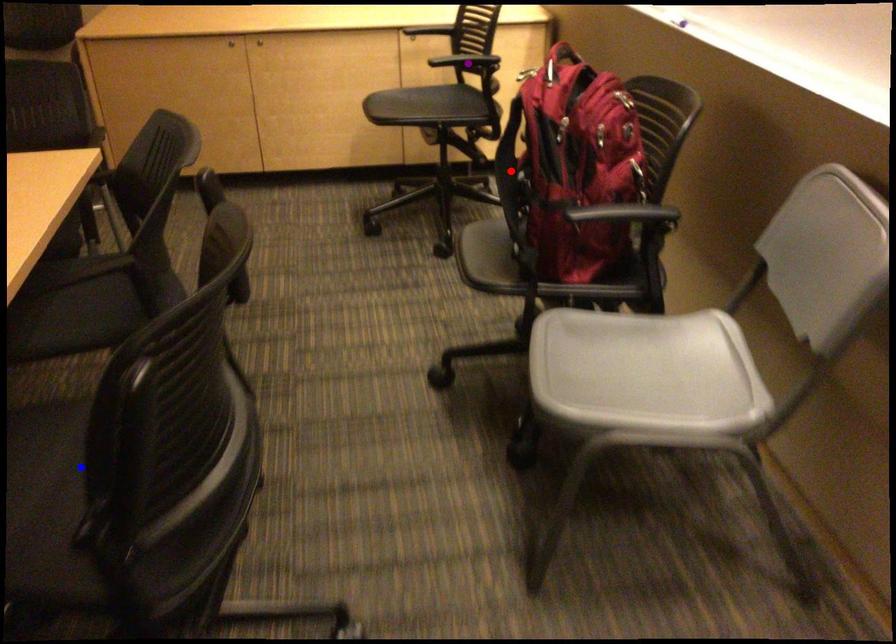
Based on the photo, order these from nearest to farthest:
red point
purple point
blue point

blue point < red point < purple point